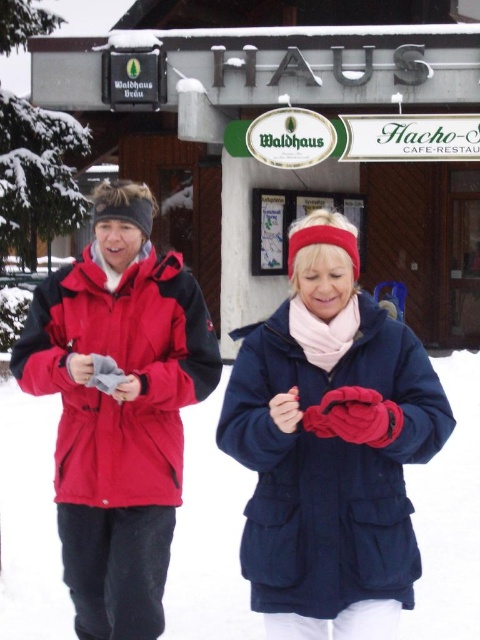
Between matte red jacket at center and navy blue cotton jacket at center, which one is positioned lower?

navy blue cotton jacket at center is below.

Between matte red jacket at center and navy blue cotton jacket at center, which one has less height?

navy blue cotton jacket at center

This screenshot has width=480, height=640. Find the location of `matte red jacket at center`. matte red jacket at center is located at coordinates (332, 445).

Between matte red jacket at center and matte red jacket at left, which one has more height?

matte red jacket at center is taller.

Is point (58, 483) farther from camera compared to point (156, 374)?

Yes, it is.

What are the coordinates of `matte red jacket at center` in the screenshot? It's located at (332, 445).

Is navy blue cotton jacket at center wider than matte red jacket at left?

Incorrect, navy blue cotton jacket at center's width does not surpass matte red jacket at left's.

Does navy blue cotton jacket at center appear on the right side of matte red jacket at left?

Correct, you'll find navy blue cotton jacket at center to the right of matte red jacket at left.

Which is in front, point (384, 484) or point (72, 285)?

Point (384, 484)

This screenshot has width=480, height=640. Find the location of `navy blue cotton jacket at center`. navy blue cotton jacket at center is located at coordinates (331, 467).